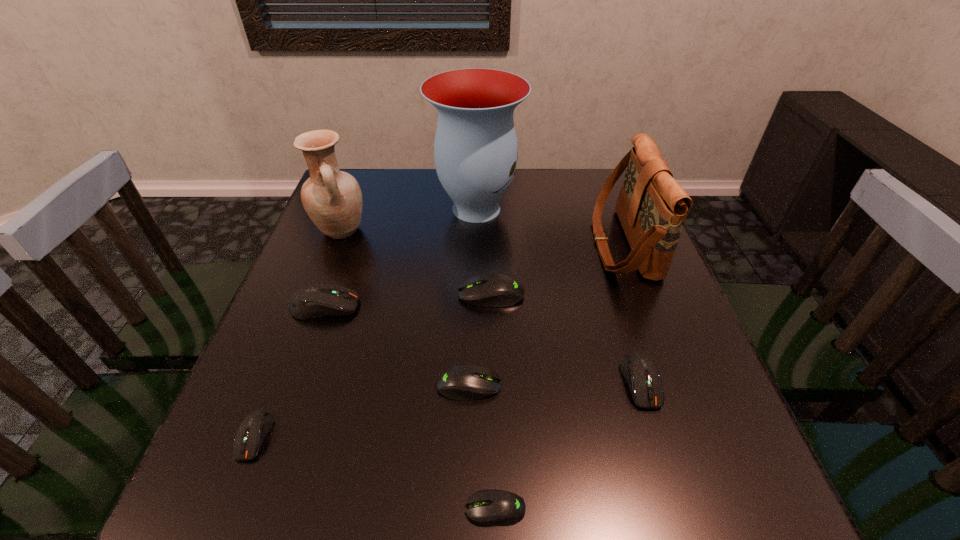
The width and height of the screenshot is (960, 540). What are the coordinates of `vase` in the screenshot? It's located at (475, 151).

Image resolution: width=960 pixels, height=540 pixels. Find the location of `red vase`. red vase is located at coordinates (475, 151).

Image resolution: width=960 pixels, height=540 pixels. Identify the location of pink pottery. (332, 198).

Locate an element on the screen. This screenshot has height=540, width=960. shoulder bag is located at coordinates (652, 207).

The height and width of the screenshot is (540, 960). Identify the location of the farthest dark computer equipment. (317, 300).

Identify the location of the farthest gray computer mouse. (496, 290).

I want to click on the rightmost dark computer equipment, so click(640, 372).

Locate an element on the screen. This screenshot has height=540, width=960. the second farthest dark computer equipment is located at coordinates (640, 372).

Find the location of a particular element. The width and height of the screenshot is (960, 540). the second biggest gray computer mouse is located at coordinates (465, 382).

The height and width of the screenshot is (540, 960). What are the coordinates of `the second nearest computer mouse` in the screenshot? It's located at (252, 431).